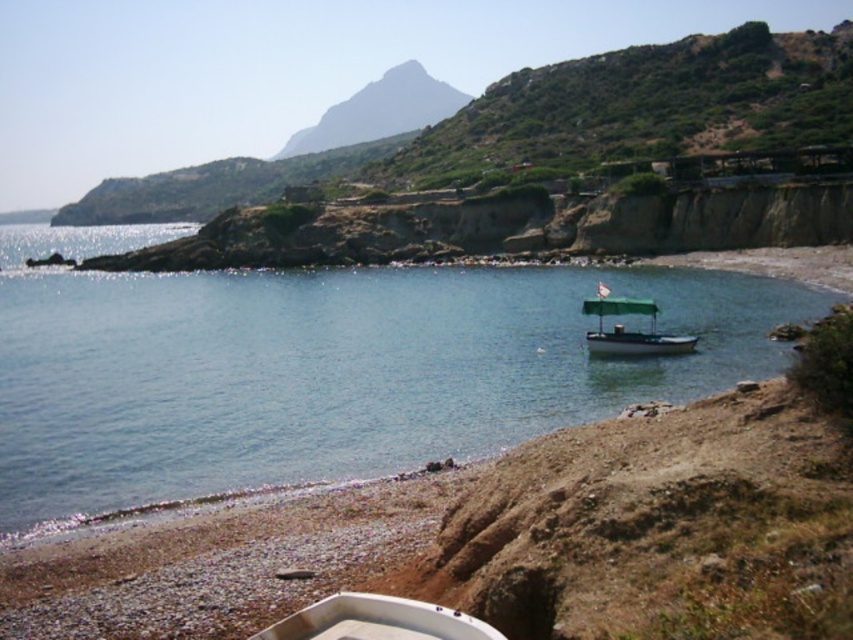
Between clear blue water at center and green canvas boat at center, which one is positioned higher?

clear blue water at center is above.

Which of these two, clear blue water at center or green canvas boat at center, stands taller?

With more height is clear blue water at center.

I want to click on clear blue water at center, so click(x=321, y=369).

This screenshot has width=853, height=640. In order to click on clear blue water at center in this screenshot , I will do `click(321, 369)`.

Does white plastic boat at lower center appear under green canvas boat at center?

Yes.

Who is lower down, white plastic boat at lower center or green canvas boat at center?

white plastic boat at lower center is below.

Measure the distance between white plastic boat at lower center and camera.

white plastic boat at lower center and camera are 16.64 meters apart from each other.

You are a GUI agent. You are given a task and a screenshot of the screen. Output one action in this format:
    pyautogui.click(x=<x>, y=<y>)
    Task: Click on the white plastic boat at lower center
    This screenshot has width=853, height=640.
    Given the screenshot: What is the action you would take?
    pyautogui.click(x=376, y=620)

Is clear blue water at center below white plastic boat at lower center?

Incorrect, clear blue water at center is not positioned below white plastic boat at lower center.

How much distance is there between clear blue water at center and white plastic boat at lower center?

clear blue water at center is 158.94 feet away from white plastic boat at lower center.

Is point (7, 310) positioned before point (492, 628)?

No, (7, 310) is behind (492, 628).

Where is `clear blue water at center`? clear blue water at center is located at coordinates (321, 369).